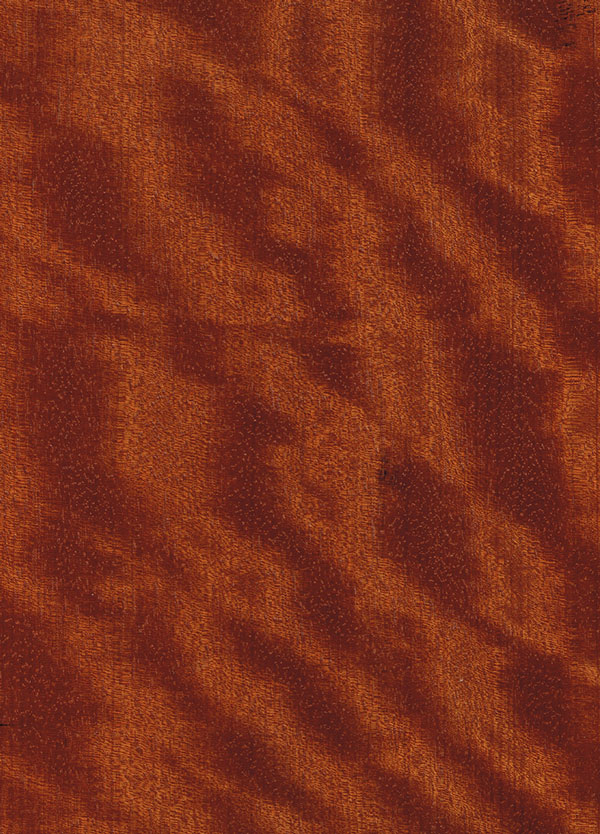
Locate an element on the screen. This screenshot has width=600, height=834. empty space left of blanket is located at coordinates (30, 390).